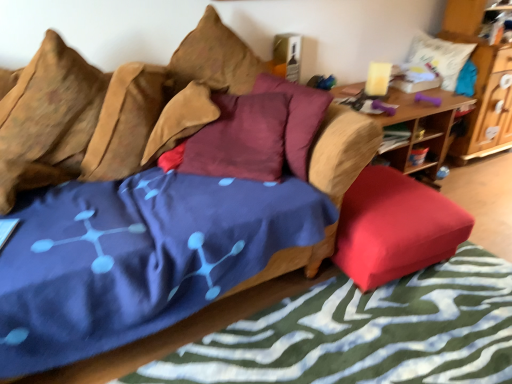
This screenshot has width=512, height=384. What do you see at coordinates (297, 118) in the screenshot?
I see `maroon fabric pillow at center, which is the third pillow from left to right` at bounding box center [297, 118].

Where is `wooden table at right`? Image resolution: width=512 pixels, height=384 pixels. wooden table at right is located at coordinates (421, 130).

Describe the element at coordinates (366, 333) in the screenshot. I see `blue fabric bed frame at lower left` at that location.

Image resolution: width=512 pixels, height=384 pixels. I want to click on textured brown pillow at upper center, which is counted as the third pillow, starting from the right, so click(214, 59).

Identify the location of blue fabric mattress at center. (137, 257).

Looking at their sizes, would you say wooden cabinet at upper right is wider or thinner than textured brown pillow at upper left, acting as the fourth pillow starting from the right?

Considering their sizes, wooden cabinet at upper right looks broader than textured brown pillow at upper left, acting as the fourth pillow starting from the right.

Can you confirm if wooden cabinet at upper right is shorter than textured brown pillow at upper left, acting as the fourth pillow starting from the right?

No, wooden cabinet at upper right is not shorter than textured brown pillow at upper left, acting as the fourth pillow starting from the right.

Is wooden cabinet at upper right inside the boundaries of textured brown pillow at upper left, marked as the first pillow in a left-to-right arrangement, or outside?

The correct answer is: outside.

From the image's perspective, which one is positioned lower, wooden cabinet at upper right or textured brown pillow at upper left, marked as the first pillow in a left-to-right arrangement?

textured brown pillow at upper left, marked as the first pillow in a left-to-right arrangement, from the image's perspective.

From a real-world perspective, is wooden table at right physically located above or below velvet-like brown couch at center?

Clearly, from a real-world perspective, wooden table at right is below velvet-like brown couch at center.

Is wooden table at right not inside velvet-like brown couch at center?

wooden table at right is positioned outside velvet-like brown couch at center.

Considering the relative sizes of wooden table at right and velvet-like brown couch at center in the image provided, is wooden table at right wider than velvet-like brown couch at center?

No.

Which is further, (393, 96) or (28, 85)?

Point (393, 96)

Which of these two, blue fabric bed frame at lower left or red fabric ottoman at lower right, is wider?

blue fabric bed frame at lower left.

Is blue fabric bed frame at lower left taller or shorter than red fabric ottoman at lower right?

Clearly, blue fabric bed frame at lower left is shorter compared to red fabric ottoman at lower right.

From a real-world perspective, is blue fabric bed frame at lower left beneath red fabric ottoman at lower right?

Correct, in the physical world, blue fabric bed frame at lower left is lower than red fabric ottoman at lower right.

Does blue fabric bed frame at lower left have a smaller size compared to red fabric ottoman at lower right?

Yes, blue fabric bed frame at lower left is smaller than red fabric ottoman at lower right.

Between velvet-like brown couch at center and blue fabric mattress at center, which one is positioned behind?

velvet-like brown couch at center is further from the camera.

From a real-world perspective, which object stands above the other?

From a 3D spatial view, velvet-like brown couch at center is above.

Which of these two, velvet-like brown couch at center or blue fabric mattress at center, is thinner?

velvet-like brown couch at center is thinner.

Find the location of `chair on the left side of wooden table at right`. chair on the left side of wooden table at right is located at coordinates (395, 227).

Based on the photo, can you confirm if wooden table at right is wider than red fabric ottoman at lower right?

Correct, the width of wooden table at right exceeds that of red fabric ottoman at lower right.

From the image's perspective, is wooden table at right on top of red fabric ottoman at lower right?

Yes, from the image's perspective, wooden table at right is on top of red fabric ottoman at lower right.

Looking at this image, from a real-world perspective, is wooden table at right physically located above or below red fabric ottoman at lower right?

In terms of real-world spatial position, wooden table at right is above red fabric ottoman at lower right.

Does point (411, 123) come farther from viewer compared to point (445, 11)?

No, it is in front of (445, 11).

In the scene shown: From a real-world perspective, is wooden table at right positioned above or below wooden cabinet at upper right?

wooden table at right is below wooden cabinet at upper right.

Identify the location of table that appears below the wooden cabinet at upper right (from a real-world perspective). (421, 130).

Between wooden table at right and wooden cabinet at upper right, which one has less height?

With less height is wooden table at right.

Is textured brown pillow at upper left, marked as the first pillow in a left-to-right arrangement, far from red fabric ottoman at lower right?

Indeed, textured brown pillow at upper left, marked as the first pillow in a left-to-right arrangement, is not near red fabric ottoman at lower right.

Is textured brown pillow at upper left, marked as the first pillow in a left-to-right arrangement, situated inside red fabric ottoman at lower right or outside?

textured brown pillow at upper left, marked as the first pillow in a left-to-right arrangement, is outside red fabric ottoman at lower right.

Which object is thinner, textured brown pillow at upper left, acting as the fourth pillow starting from the right, or red fabric ottoman at lower right?

With smaller width is textured brown pillow at upper left, acting as the fourth pillow starting from the right.

From the image's perspective, which pillow is the 3rd one below the wooden cabinet at upper right? Please provide its 2D coordinates.

[(47, 119)]

Find the location of a particular element. studio couch that is above the wooden table at right (from a real-world perspective) is located at coordinates (114, 108).

Which object lies nearer to the anchor point maroon fabric pillow at center, which is the third pillow from left to right, wooden table at right or wooden cabinet at upper right?

wooden table at right is closer to maroon fabric pillow at center, which is the third pillow from left to right.

Based on their spatial positions, is textured brown pillow at upper left, acting as the fourth pillow starting from the right, or maroon fabric pillow at center, acting as the 2th pillow starting from the right, closer to wooden table at right?

maroon fabric pillow at center, acting as the 2th pillow starting from the right, lies closer to wooden table at right than the other object.

Based on their spatial positions, is red fabric ottoman at lower right or textured brown pillow at upper center, the second pillow in the left-to-right sequence, further from wooden cabinet at upper right?

The object further to wooden cabinet at upper right is textured brown pillow at upper center, the second pillow in the left-to-right sequence.

From the image, which object appears to be nearer to red fabric ottoman at lower right, wooden table at right or textured brown pillow at upper center, which is counted as the third pillow, starting from the right?

The object closer to red fabric ottoman at lower right is wooden table at right.

When comparing their distances from wooden cabinet at upper right, does maroon fabric pillow at center, acting as the 2th pillow starting from the right, or textured brown pillow at upper center, which is counted as the third pillow, starting from the right, seem closer?

maroon fabric pillow at center, acting as the 2th pillow starting from the right, is positioned closer to the anchor wooden cabinet at upper right.

When comparing their distances from white soft pillow at upper right, positioned as the 1th pillow in right-to-left order, does velvet-like brown couch at center or red fabric ottoman at lower right seem closer?

red fabric ottoman at lower right lies closer to white soft pillow at upper right, positioned as the 1th pillow in right-to-left order, than the other object.

Which object lies nearer to the anchor point wooden table at right, textured brown pillow at upper center, the second pillow in the left-to-right sequence, or blue fabric bed frame at lower left?

Based on the image, textured brown pillow at upper center, the second pillow in the left-to-right sequence, appears to be nearer to wooden table at right.

Looking at the image, which one is located further to maroon fabric pillow at center, acting as the 2th pillow starting from the right, textured brown pillow at upper left, marked as the first pillow in a left-to-right arrangement, or velvet-like brown couch at center?

textured brown pillow at upper left, marked as the first pillow in a left-to-right arrangement.

Identify the location of bed frame located between blue fabric mattress at center and wooden table at right in the depth direction. The width and height of the screenshot is (512, 384). (366, 333).

Locate an element on the screen. studio couch between blue fabric mattress at center and wooden table at right along the z-axis is located at coordinates (114, 108).

Find the location of a particular element. This screenshot has height=384, width=512. mattress situated between textured brown pillow at upper left, marked as the first pillow in a left-to-right arrangement, and white soft pillow at upper right, which appears as the 4th pillow when viewed from the left, from left to right is located at coordinates (137, 257).

I want to click on studio couch located between textured brown pillow at upper left, marked as the first pillow in a left-to-right arrangement, and maroon fabric pillow at center, acting as the 2th pillow starting from the right, in the left-right direction, so click(x=114, y=108).